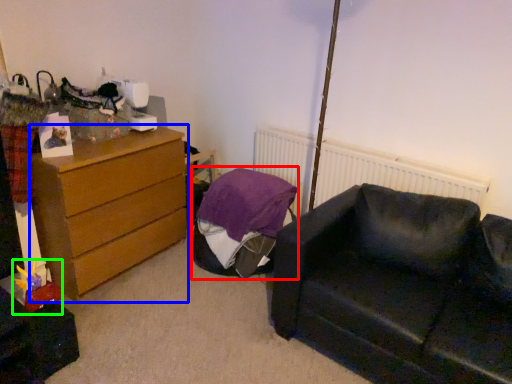
Question: Estimate the real-world distances between objects in this image. Which object is farther from bean bag chair (highlighted by a red box), chest of drawers (highlighted by a blue box) or toy (highlighted by a green box)?

Choices:
 (A) chest of drawers
 (B) toy

Answer: (B)